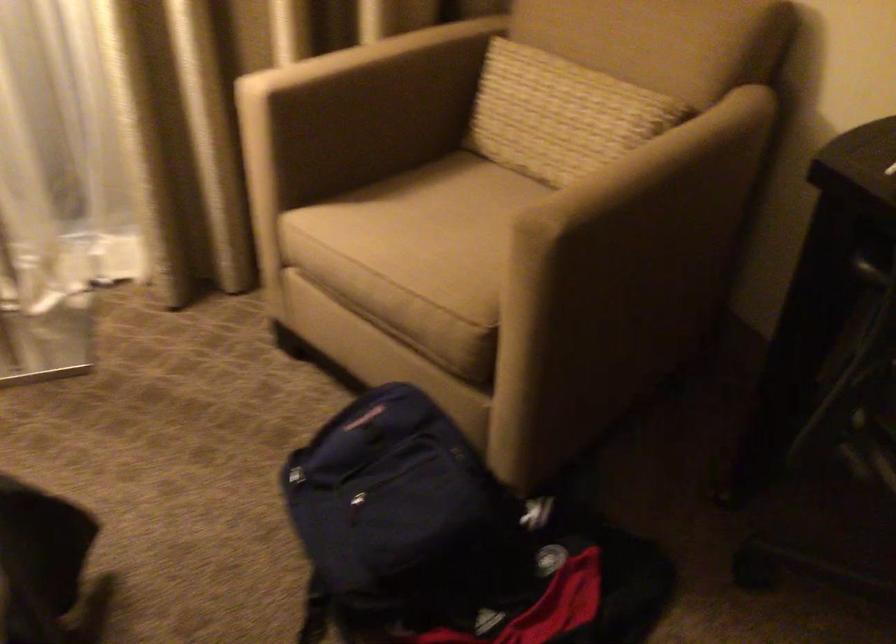
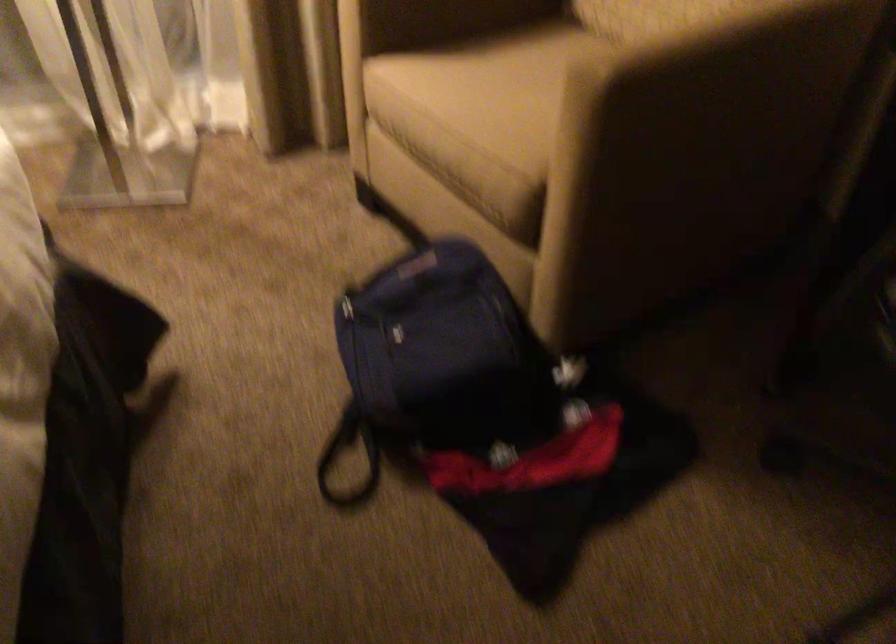
Find the pixel in the second image that matches (412,527) in the first image.

(442, 366)